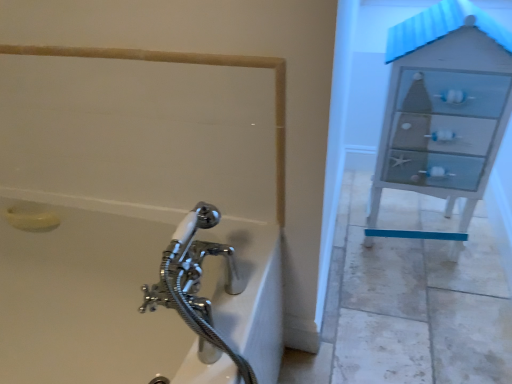
I want to click on vacant space situated on the left part of white glossy file cabinet at right, so click(351, 261).